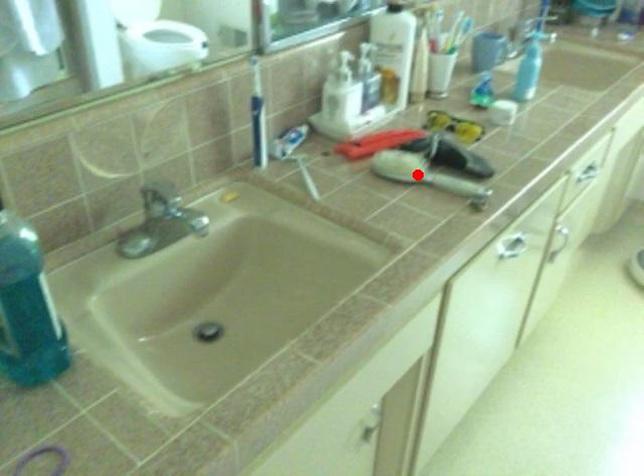
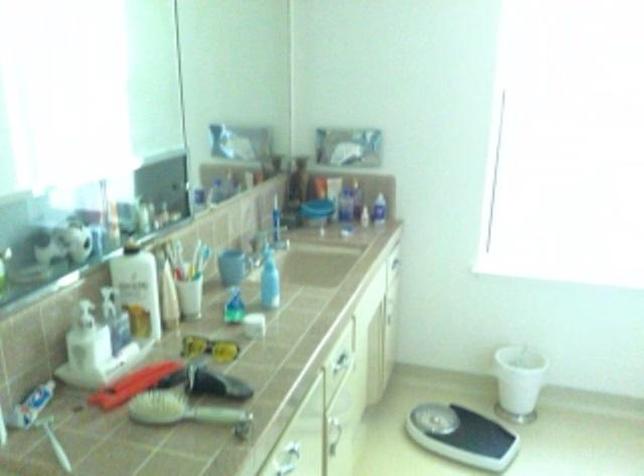
Locate, in the second image, the point that corresponds to the highlighted location in the first image.

(178, 410)